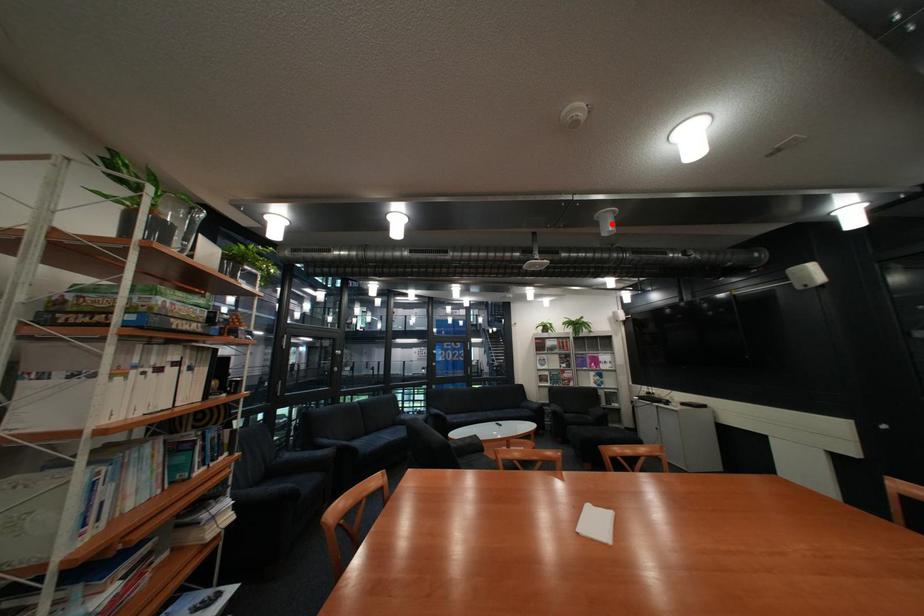
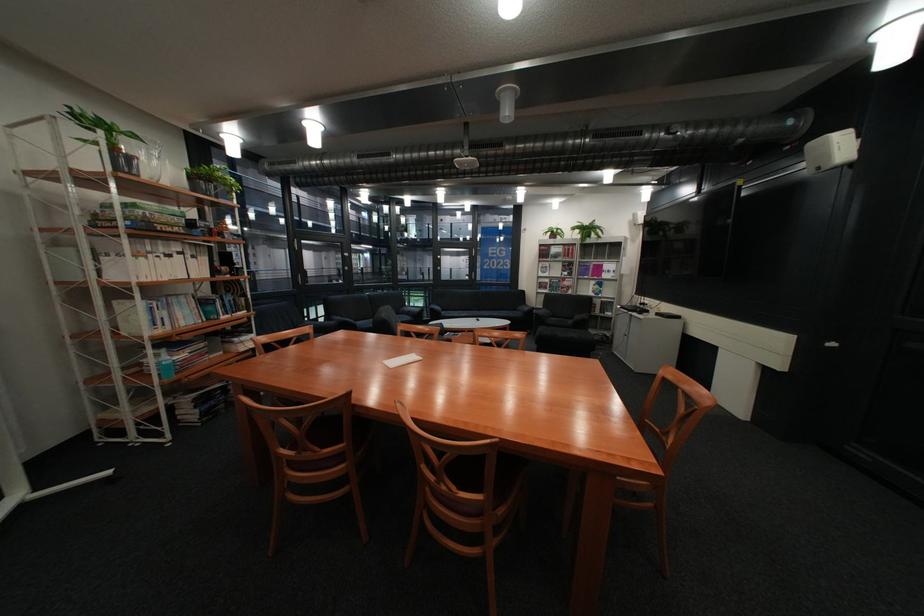
The point at the highlighted location is marked in the first image. Where is the corresponding point in the second image?

(513, 108)